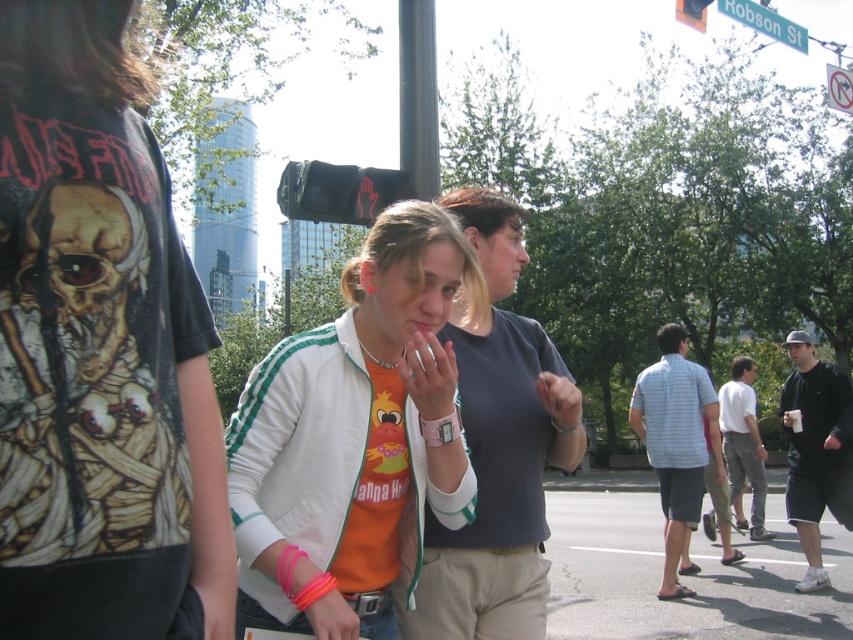
You are standing at the origin point of the coordinate system in the image. You want to locate the light blue plaid shirt at center. In which direction should you look relative to your current position?

The light blue plaid shirt at center is located at coordinate point 0.692 on the x axis and 0.794 on the y axis. Since the origin is at the bottom left corner of the image, you should look to the upper right direction to find it.

You are standing at the point marked as point (x=676, y=531) in this urban street scene. A friend is 1.7 meters tall and wants to know if they can see the top of the building that is 25 meters tall from this point. The friend is currently at a height of 1.6 meters. Can they see the top?

The distance of point (x=676, y=531) from viewer is 6.56 meters. Assuming no obstructions, the friend can see the top of the 25 meter building from this point because the building is much taller than the friend.